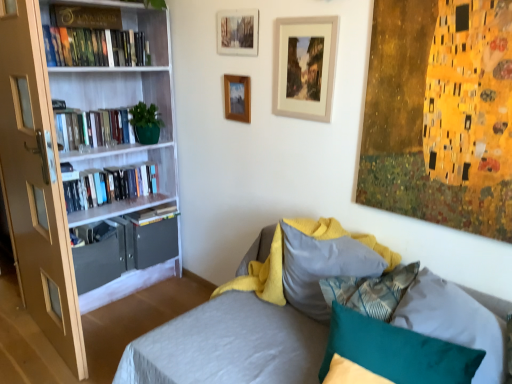
Question: Based on their sizes in the image, would you say hardcover books at left, the third book positioned from the top, is bigger or smaller than teal fabric pillow at lower right, which appears as the second pillow when viewed from the back?

Choices:
 (A) big
 (B) small

Answer: (A)

Question: Is hardcover books at left, the third book positioned from the top, taller or shorter than teal fabric pillow at lower right, arranged as the 1th pillow when viewed from the front?

Choices:
 (A) short
 (B) tall

Answer: (A)

Question: Estimate the real-world distances between objects in this image. Which object is closer to the hardcover book at left, the 1th book ordered from the bottom?

Choices:
 (A) wooden picture frame at upper center, the first picture frame in the right-to-left sequence
 (B) hardcover book at left, which appears as the 2th book when viewed from the top
 (C) matte gray drawer at lower left
 (D) gold metallic sign at upper left, which is the 1th book from top to bottom
 (E) wooden picture frame at upper center, which is the 3th picture frame from right to left

Answer: (C)

Question: Which object is positioned closest to the wooden picture frame at upper center, which is the 3th picture frame from right to left?

Choices:
 (A) hardcover books at left, the third book positioned from the top
 (B) hardcover book at left, which appears as the 2th book when viewed from the top
 (C) gold metallic sign at upper left, which is the 1th book from top to bottom
 (D) hardcover book at left, the 1th book ordered from the bottom
 (E) matte gray drawer at lower left

Answer: (B)